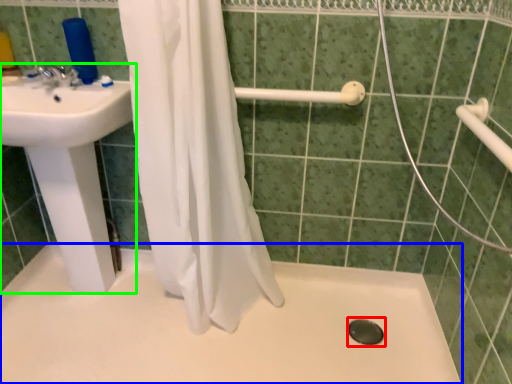
Question: Which object is the closest to the drain (highlighted by a red box)? Choose among these: bath (highlighted by a blue box) or sink (highlighted by a green box).

Choices:
 (A) bath
 (B) sink

Answer: (A)